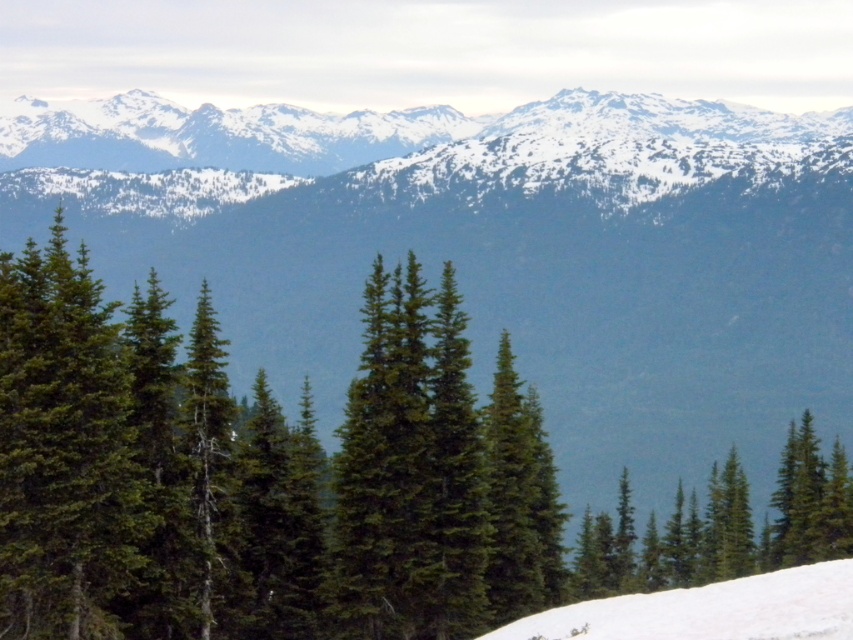
Question: Does green matte tree at center have a greater width compared to green matte tree at lower right?

Choices:
 (A) yes
 (B) no

Answer: (A)

Question: Can you confirm if green matte tree at center is positioned to the left of green matte tree at lower right?

Choices:
 (A) no
 (B) yes

Answer: (B)

Question: Which point is closer to the camera?

Choices:
 (A) (804, 614)
 (B) (792, 429)
 (C) (511, 467)

Answer: (A)

Question: Which object appears farthest from the camera in this image?

Choices:
 (A) white snow at lower right
 (B) green matte tree at center

Answer: (B)

Question: Is green matte tree at center in front of green matte tree at lower right?

Choices:
 (A) yes
 (B) no

Answer: (A)

Question: Which of the following is the farthest from the observer?

Choices:
 (A) (672, 580)
 (B) (347, 547)
 (C) (577, 625)

Answer: (A)